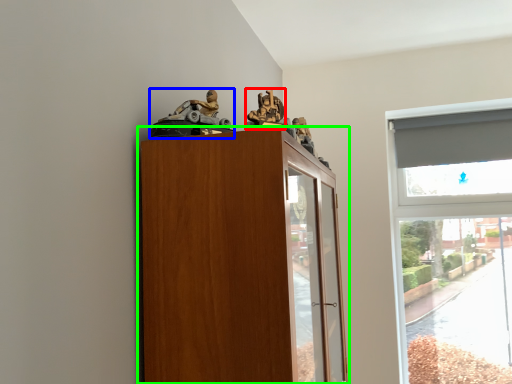
Question: Which object is positioned farthest from toy (highlighted by a red box)? Select from toy (highlighted by a blue box) and cupboard (highlighted by a green box).

Choices:
 (A) toy
 (B) cupboard

Answer: (B)